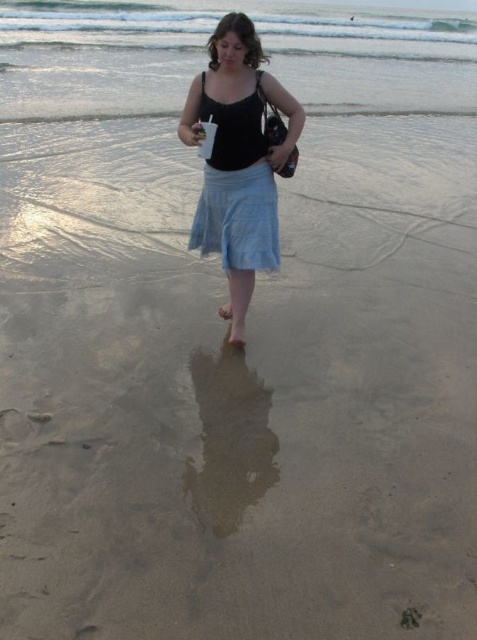
Is clear water at upper center positioned in front of matte black tank top at center?

No, it is behind matte black tank top at center.

Can you confirm if clear water at upper center is taller than matte black tank top at center?

Yes, clear water at upper center is taller than matte black tank top at center.

Is point (447, 88) in front of point (232, 131)?

No.

The image size is (477, 640). I want to click on clear water at upper center, so click(x=205, y=54).

Describe the element at coordinates (238, 161) in the screenshot. I see `matte black tank top at center` at that location.

Can you confirm if matte black tank top at center is smaller than light blue cotton skirt at center?

No.

Is point (229, 244) behind point (272, 216)?

Yes, point (229, 244) is behind point (272, 216).

You are a GUI agent. You are given a task and a screenshot of the screen. Output one action in this format:
    pyautogui.click(x=<x>, y=<y>)
    Task: Click on the matte black tank top at center
    Image resolution: width=477 pixels, height=640 pixels.
    Given the screenshot: What is the action you would take?
    pyautogui.click(x=238, y=161)

Can you confirm if clear water at upper center is bigger than light blue cotton skirt at center?

Indeed, clear water at upper center has a larger size compared to light blue cotton skirt at center.

Who is lower down, clear water at upper center or light blue cotton skirt at center?

light blue cotton skirt at center is lower down.

Between point (111, 102) and point (204, 74), which one is positioned in front?

Point (204, 74) is in front.

The width and height of the screenshot is (477, 640). In order to click on clear water at upper center in this screenshot , I will do `click(205, 54)`.